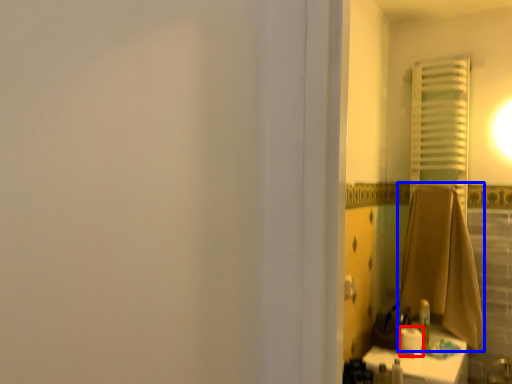
Question: Which object appears closest to the camera in this image, toilet paper (highlighted by a red box) or bath towel (highlighted by a blue box)?

Choices:
 (A) toilet paper
 (B) bath towel

Answer: (A)